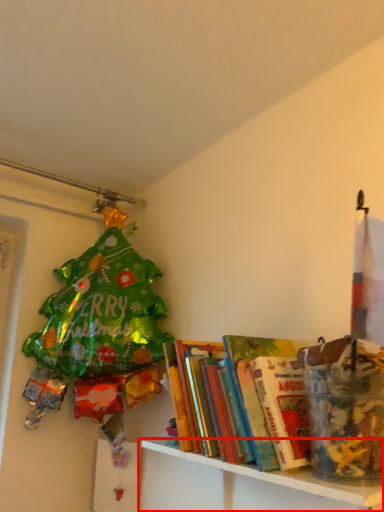
Question: From the image's perspective, what is the correct spatial positioning of shelf (annotated by the red box) in reference to book?

Choices:
 (A) above
 (B) below

Answer: (B)